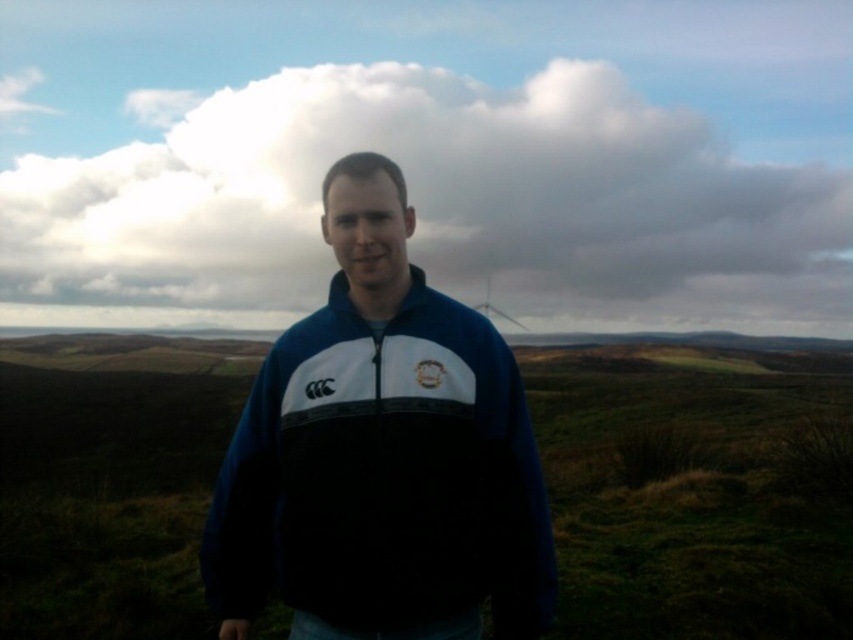
Question: Which point appears closest to the camera in this image?

Choices:
 (A) (297, 349)
 (B) (190, 624)
 (C) (488, 292)

Answer: (A)

Question: Which of these objects is positioned farthest from the white plastic wind turbine at upper center?

Choices:
 (A) blue fleece jacket at center
 (B) green grassy at center

Answer: (B)

Question: Can you confirm if green grassy at center is positioned to the left of white plastic wind turbine at upper center?

Choices:
 (A) no
 (B) yes

Answer: (B)

Question: Considering the real-world distances, which object is closest to the white plastic wind turbine at upper center?

Choices:
 (A) green grassy at center
 (B) blue fleece jacket at center

Answer: (B)

Question: Where is blue fleece jacket at center located in relation to white plastic wind turbine at upper center in the image?

Choices:
 (A) right
 (B) left

Answer: (B)

Question: Where is green grassy at center located in relation to white plastic wind turbine at upper center in the image?

Choices:
 (A) right
 (B) left

Answer: (B)